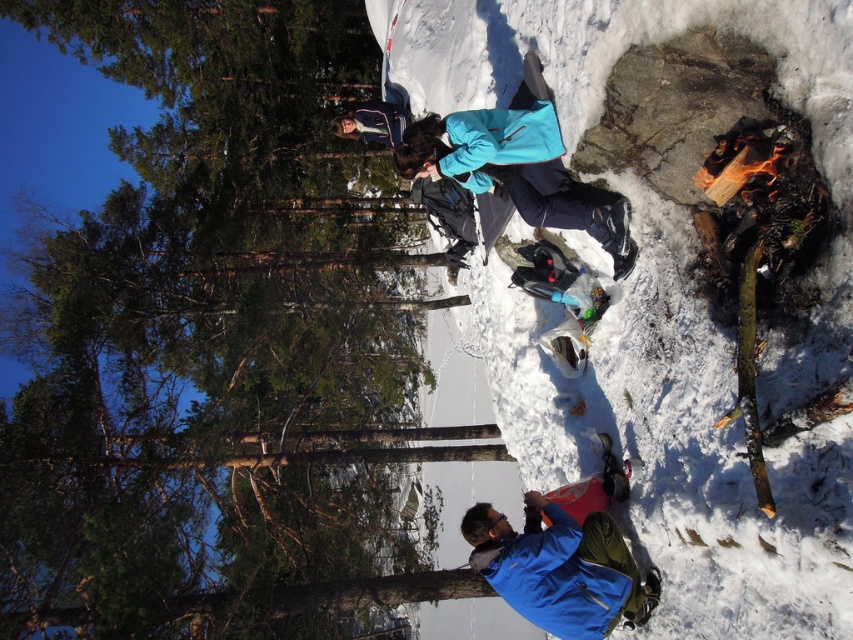
Question: Based on their relative distances, which object is nearer to the white fluffy snow at lower right?

Choices:
 (A) blue fabric jacket at lower center
 (B) green matte tree at upper left

Answer: (A)

Question: Is green matte tree at upper left behind white fluffy snow at lower right?

Choices:
 (A) yes
 (B) no

Answer: (A)

Question: Can you confirm if white fluffy snow at lower right is thinner than blue fabric jacket at lower center?

Choices:
 (A) no
 (B) yes

Answer: (A)

Question: Which is nearer to the white fluffy snow at lower right?

Choices:
 (A) green matte tree at upper left
 (B) blue fabric jacket at lower center

Answer: (B)

Question: Which of the following is the farthest from the observer?

Choices:
 (A) (618, 412)
 (B) (579, 611)
 (C) (26, 445)

Answer: (C)

Question: Does white fluffy snow at lower right appear under blue fabric jacket at lower center?

Choices:
 (A) no
 (B) yes

Answer: (A)